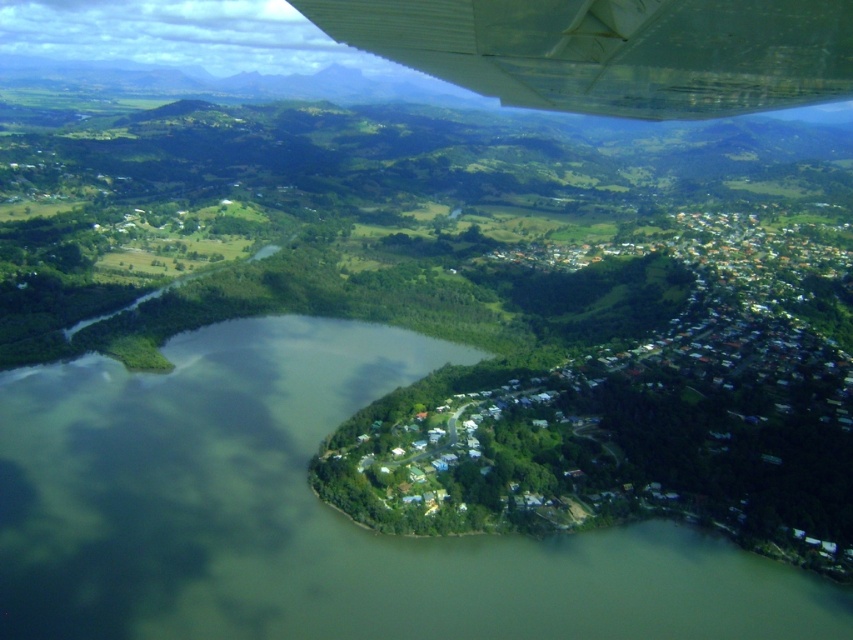
Question: Among these objects, which one is farthest from the camera?

Choices:
 (A) white metallic wing at upper center
 (B) green water at center

Answer: (B)

Question: Observing the image, what is the correct spatial positioning of green water at center in reference to white metallic wing at upper center?

Choices:
 (A) above
 (B) below

Answer: (B)

Question: Which object appears closest to the camera in this image?

Choices:
 (A) green water at center
 (B) white metallic wing at upper center

Answer: (B)

Question: Observing the image, what is the correct spatial positioning of green water at center in reference to white metallic wing at upper center?

Choices:
 (A) right
 (B) left

Answer: (B)

Question: Is green water at center positioned at the back of white metallic wing at upper center?

Choices:
 (A) no
 (B) yes

Answer: (B)